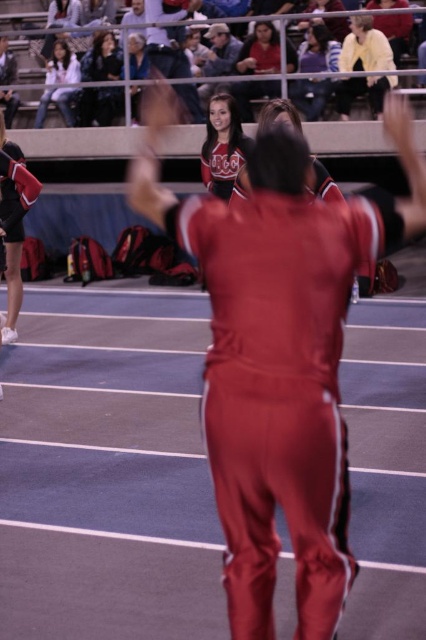
You are a photographer at the sports event and want to capture both the matte black jacket at upper left and the matte black jacket at upper center in a single photo. Which jacket should you focus on first to ensure both are in frame?

The matte black jacket at upper left is larger in size than the matte black jacket at upper center. Focus on the matte black jacket at upper left first to ensure both are in frame since it takes up more space and adjusting the camera angle to include it would naturally include the smaller one.

You are a photographer at the sports event and want to capture both the matte black jacket at upper left and the matte white jacket at upper left in a single photo. Which jacket will appear lower in the photo?

The matte black jacket at upper left will appear lower in the photo because it is positioned under the matte white jacket at upper left.

You are a photographer at the sports event. You want to take a photo that includes both the matte black jacket at upper center and the matte white jacket at upper left. Given that your camera has a maximum focus range of 5 meters, will you be able to capture both jackets in the same frame without moving the camera?

The matte black jacket at upper center and matte white jacket at upper left are 5.38 meters apart from each other, which exceeds the camera maximum focus range of 5 meters. Therefore, you cannot capture both jackets in the same frame without moving the camera.